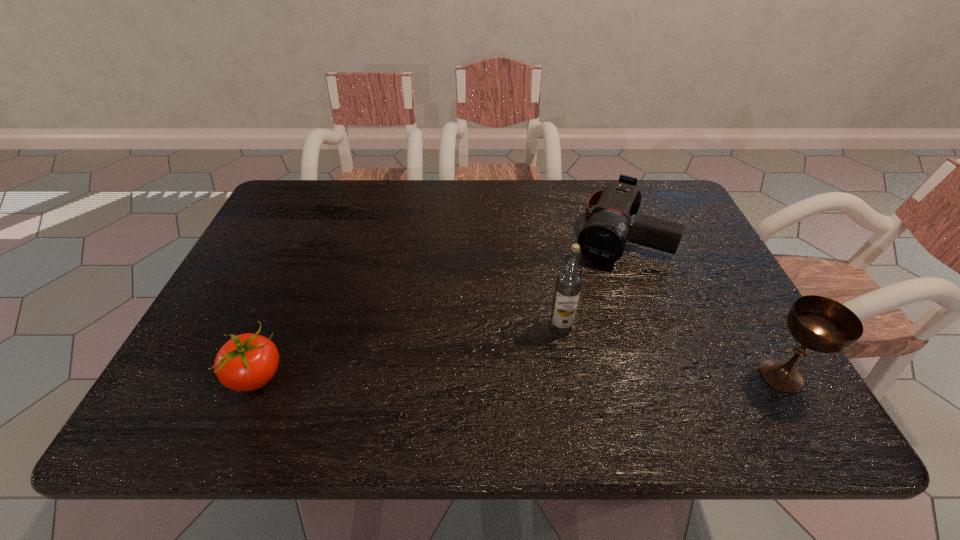
You are a GUI agent. You are given a task and a screenshot of the screen. Output one action in this format:
    pyautogui.click(x=<x>, y=<y>)
    Task: Click on the free area in between the rightmost object and the tomato
    The width and height of the screenshot is (960, 540).
    Given the screenshot: What is the action you would take?
    pyautogui.click(x=519, y=376)

Where is `object that stands as the second closest to the tomato`? The width and height of the screenshot is (960, 540). object that stands as the second closest to the tomato is located at coordinates (603, 239).

The height and width of the screenshot is (540, 960). I want to click on object that is the third closest one to the camcorder, so click(247, 362).

The width and height of the screenshot is (960, 540). I want to click on blank area in the image that satisfies the following two spatial constraints: 1. on the back side of the tomato; 2. on the left side of the tallest object, so click(277, 328).

Find the location of a particular element. The height and width of the screenshot is (540, 960). free space in the image that satisfies the following two spatial constraints: 1. on the front side of the third object from left to right; 2. on the left side of the rightmost object is located at coordinates (666, 375).

Where is `vacant point that satisfies the following two spatial constraints: 1. on the back side of the third object from left to right; 2. on the right side of the leftmost object`? vacant point that satisfies the following two spatial constraints: 1. on the back side of the third object from left to right; 2. on the right side of the leftmost object is located at coordinates (318, 233).